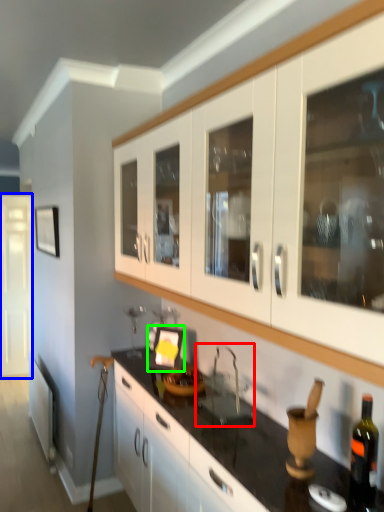
Question: Estimate the real-world distances between objects in this image. Which object is closer to sink (highlighted by a red box), glass door (highlighted by a blue box) or picture frame (highlighted by a green box)?

Choices:
 (A) glass door
 (B) picture frame

Answer: (B)